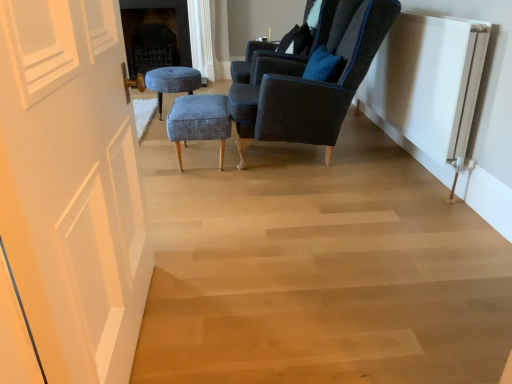
The image size is (512, 384). What are the coordinates of `vacant space to the left of blue fabric stool at center, marked as the first stool in a front-to-back arrangement` in the screenshot? It's located at (155, 158).